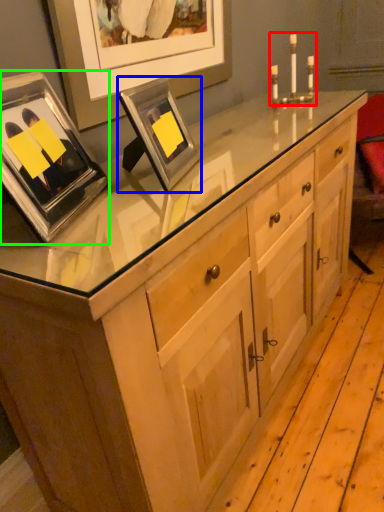
Question: Which object is positioned farthest from candle holder (highlighted by a red box)? Select from picture frame (highlighted by a blue box) and picture frame (highlighted by a green box).

Choices:
 (A) picture frame
 (B) picture frame

Answer: (B)